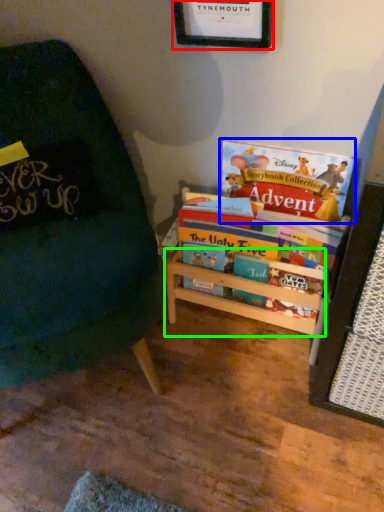
Question: Estimate the real-world distances between objects in this image. Which object is closer to picture frame (highlighted by a red box), book (highlighted by a blue box) or shelf (highlighted by a green box)?

Choices:
 (A) book
 (B) shelf

Answer: (A)